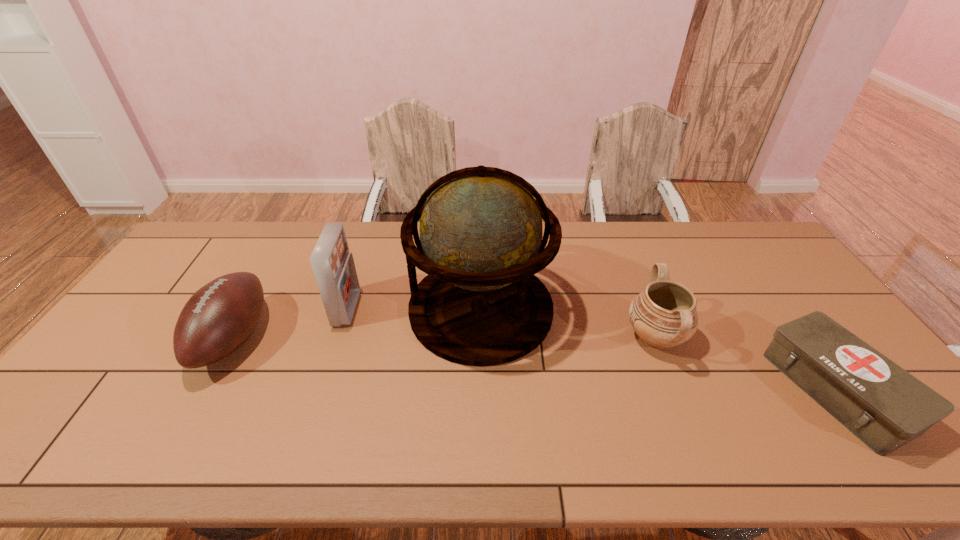
Locate an element on the screen. The height and width of the screenshot is (540, 960). free space located 0.210m on the front-facing side of the globe is located at coordinates (340, 309).

At what (x,y) coordinates should I click in order to perform the action: click on vacant space positioned 0.360m on the front-facing side of the left first-aid kit. Please return your answer as a coordinate pair (x, y). This screenshot has height=540, width=960. Looking at the image, I should click on (475, 309).

What are the coordinates of `vacant space situated on the front-facing side of the second object from right to left` in the screenshot? It's located at (602, 337).

Identify the location of vacant space located on the front-facing side of the second object from right to left. The image size is (960, 540). (566, 337).

The width and height of the screenshot is (960, 540). In order to click on vacant space located 0.320m on the front-facing side of the second object from right to left in this screenshot , I will do `click(510, 337)`.

At what (x,y) coordinates should I click in order to perform the action: click on vacant point located 0.390m on the right of the leftmost object. Please return your answer as a coordinate pair (x, y). The width and height of the screenshot is (960, 540). Looking at the image, I should click on (404, 339).

Locate an element on the screen. vacant space located on the left of the rightmost object is located at coordinates (643, 390).

Where is `object that is at the near edge`? This screenshot has height=540, width=960. object that is at the near edge is located at coordinates (883, 405).

The image size is (960, 540). In order to click on object that is at the right edge in this screenshot , I will do `click(883, 405)`.

Identify the location of object present at the near right corner. This screenshot has height=540, width=960. (883, 405).